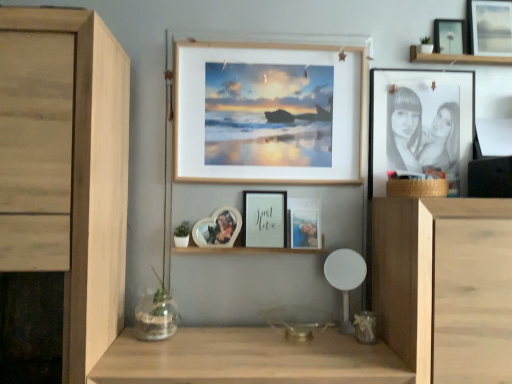
Question: Is matte black picture frame at upper right, the 6th picture frame viewed from the left, further to the viewer compared to heart-shaped photo frame at center, positioned as the 1th picture frame in left-to-right order?

Choices:
 (A) yes
 (B) no

Answer: (A)

Question: From a real-world perspective, is matte black picture frame at upper right, placed as the first picture frame when sorted from right to left, beneath heart-shaped photo frame at center, the 6th picture frame positioned from the right?

Choices:
 (A) no
 (B) yes

Answer: (A)

Question: Is matte black picture frame at upper right, placed as the first picture frame when sorted from right to left, surrounding heart-shaped photo frame at center, positioned as the 1th picture frame in left-to-right order?

Choices:
 (A) no
 (B) yes

Answer: (A)

Question: Is matte black picture frame at upper right, placed as the first picture frame when sorted from right to left, thinner than heart-shaped photo frame at center, positioned as the 1th picture frame in left-to-right order?

Choices:
 (A) yes
 (B) no

Answer: (A)

Question: Can you confirm if matte black picture frame at upper right, placed as the first picture frame when sorted from right to left, is shorter than heart-shaped photo frame at center, positioned as the 1th picture frame in left-to-right order?

Choices:
 (A) yes
 (B) no

Answer: (B)

Question: In the image, is metallic silver photo frame at center, the 4th picture frame positioned from the left, positioned in front of or behind light brown wood cabinet at lower right, acting as the first cabinetry starting from the right?

Choices:
 (A) front
 (B) behind

Answer: (B)

Question: Does point (306, 216) appear closer or farther from the camera than point (505, 228)?

Choices:
 (A) closer
 (B) farther

Answer: (B)

Question: Choose the correct answer: Is metallic silver photo frame at center, the 4th picture frame positioned from the left, inside light brown wood cabinet at lower right, acting as the first cabinetry starting from the right, or outside it?

Choices:
 (A) inside
 (B) outside

Answer: (B)

Question: Looking at the image, does metallic silver photo frame at center, the 4th picture frame positioned from the left, seem bigger or smaller compared to light brown wood cabinet at lower right, acting as the first cabinetry starting from the right?

Choices:
 (A) small
 (B) big

Answer: (A)

Question: From a real-world perspective, is heart-shaped photo frame at center, the 6th picture frame positioned from the right, physically located above or below white glossy photo frame at center?

Choices:
 (A) below
 (B) above

Answer: (B)

Question: From the image's perspective, is heart-shaped photo frame at center, positioned as the 1th picture frame in left-to-right order, located above or below white glossy photo frame at center?

Choices:
 (A) below
 (B) above

Answer: (B)

Question: From their relative heights in the image, would you say heart-shaped photo frame at center, positioned as the 1th picture frame in left-to-right order, is taller or shorter than white glossy photo frame at center?

Choices:
 (A) short
 (B) tall

Answer: (B)

Question: Considering the positions of point (215, 226) and point (234, 253), is point (215, 226) closer or farther from the camera than point (234, 253)?

Choices:
 (A) closer
 (B) farther

Answer: (A)

Question: From a real-world perspective, relative to metallic silver photo frame at center, the 4th picture frame positioned from the left, is white matte chair at center vertically above or below?

Choices:
 (A) above
 (B) below

Answer: (B)

Question: Considering the positions of point (328, 279) and point (316, 228), is point (328, 279) closer or farther from the camera than point (316, 228)?

Choices:
 (A) farther
 (B) closer

Answer: (B)